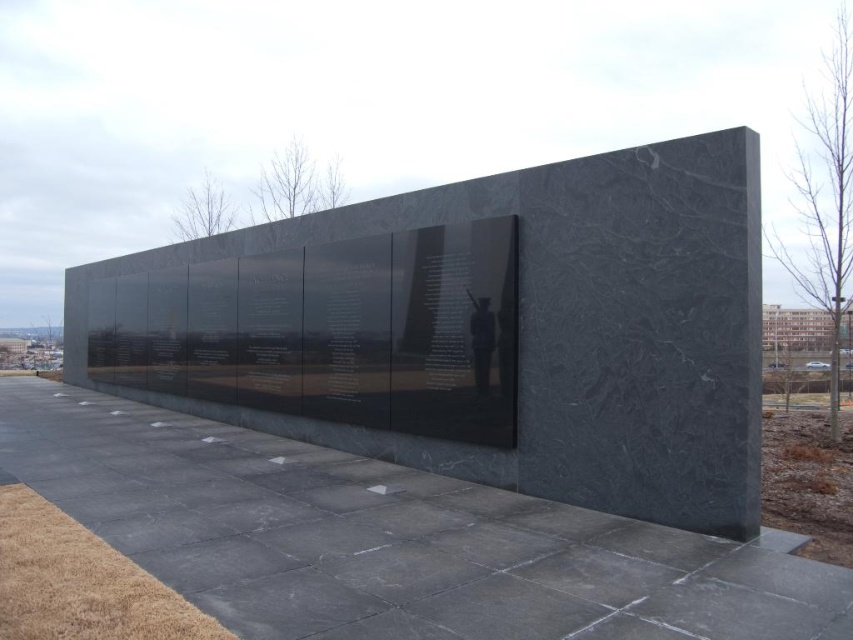
From the picture: Which is below, black polished concrete at center or matte black statue at center?

black polished concrete at center is below.

Measure the distance from black polished concrete at center to matte black statue at center.

black polished concrete at center is 2.42 meters away from matte black statue at center.

The image size is (853, 640). What do you see at coordinates (386, 538) in the screenshot?
I see `black polished concrete at center` at bounding box center [386, 538].

Identify the location of black polished concrete at center. (386, 538).

The width and height of the screenshot is (853, 640). In order to click on black polished stone wall at center in this screenshot , I will do `click(468, 330)`.

How distant is black polished stone wall at center from matte black statue at center?

black polished stone wall at center and matte black statue at center are 1.60 meters apart.

Which is behind, point (434, 188) or point (480, 307)?

Positioned behind is point (434, 188).

Where is `black polished stone wall at center`? This screenshot has width=853, height=640. black polished stone wall at center is located at coordinates (468, 330).

Based on the photo, is black polished stone wall at center thinner than black polished concrete at center?

Incorrect, black polished stone wall at center's width is not less than black polished concrete at center's.

Is black polished stone wall at center to the right of black polished concrete at center from the viewer's perspective?

In fact, black polished stone wall at center is to the left of black polished concrete at center.

Which is in front, point (128, 340) or point (99, 433)?

Point (99, 433)

The height and width of the screenshot is (640, 853). I want to click on black polished stone wall at center, so click(468, 330).